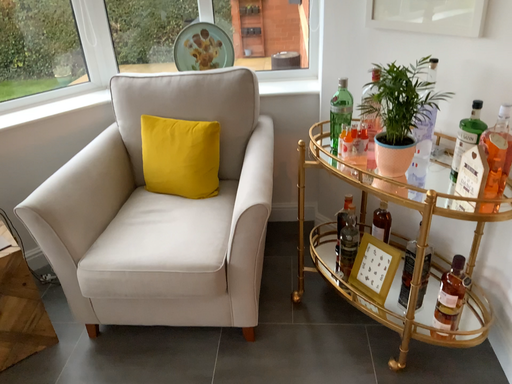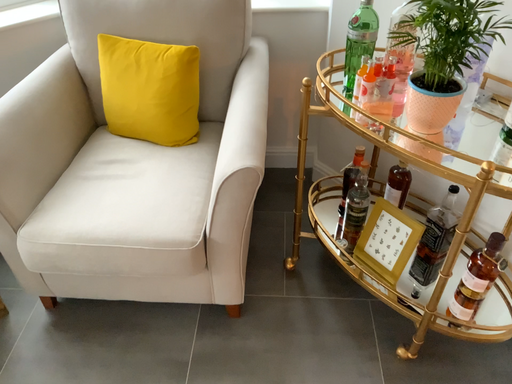
Question: Which way did the camera rotate in the video?

Choices:
 (A) rotated downward
 (B) rotated upward

Answer: (A)